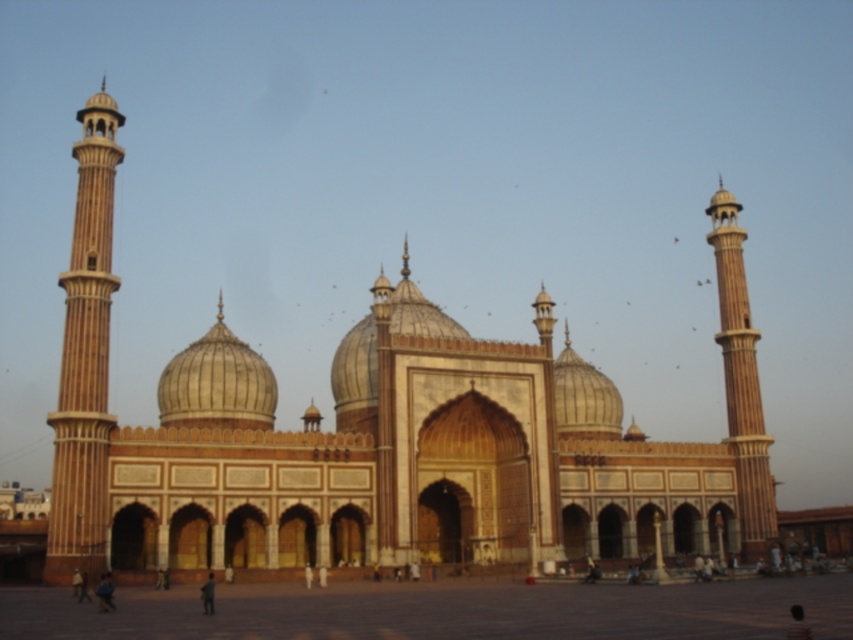
You are standing in front of the grand mosque and want to take a photo. There are two points marked on the structure at coordinates point (62,390) and point (258,356). Which point will appear larger in your photo?

Point (62,390) is closer to the camera than point (258,356), so it will appear larger in the photo.

What is the color of the main structure located at the coordinates point (393, 440) in the image?

Answer: The point (393, 440) indicates the brown stone mosque at center, so the color is brown.

What are the coordinates of the smooth beige tower at left in the image?

The smooth beige tower at left is located at coordinates (x=85, y=356).